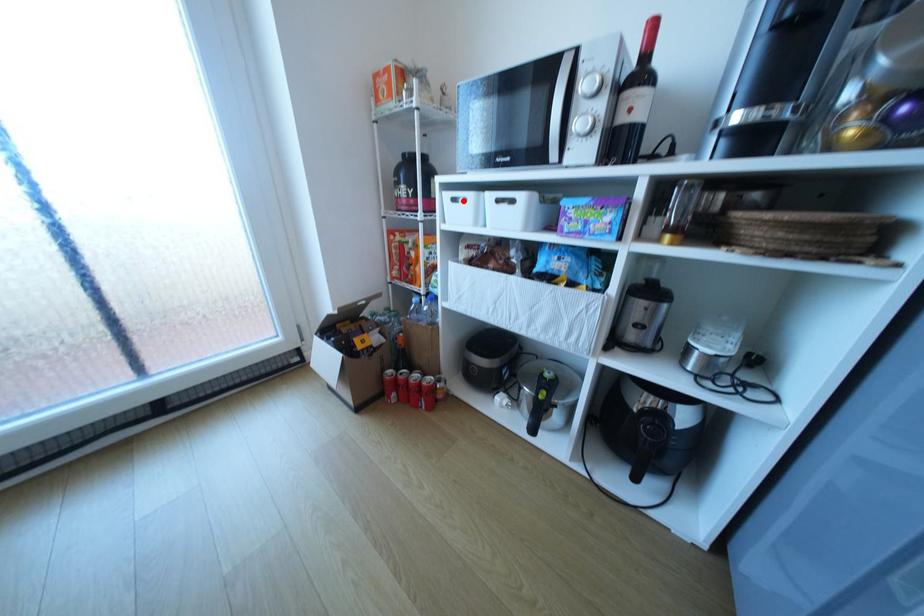
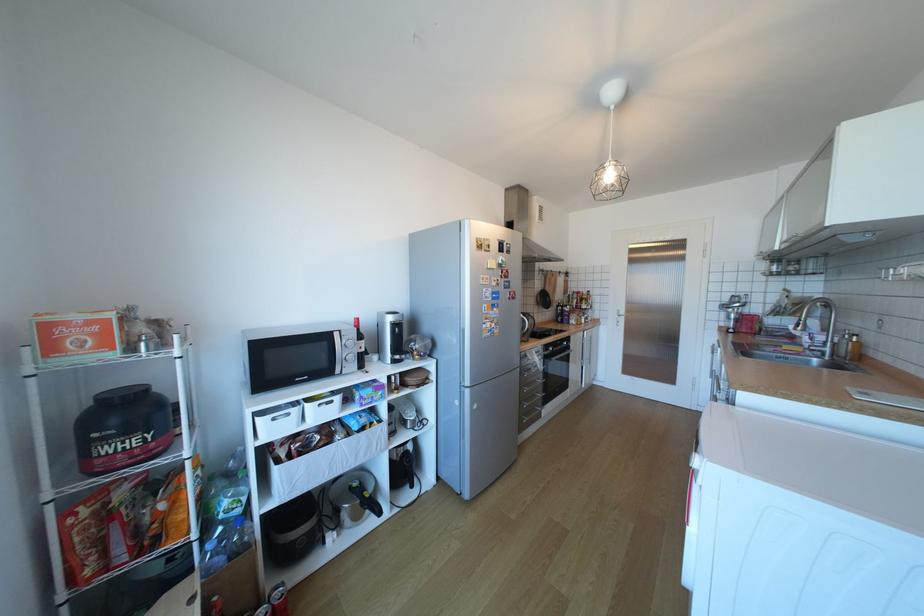
Question: A red point is marked in image1. In image2, is the corresponding 3D point closer to the camera or farther? Reply with the corresponding letter.

Choices:
 (A) The corresponding 3D point is closer.
 (B) The corresponding 3D point is farther.

Answer: (B)